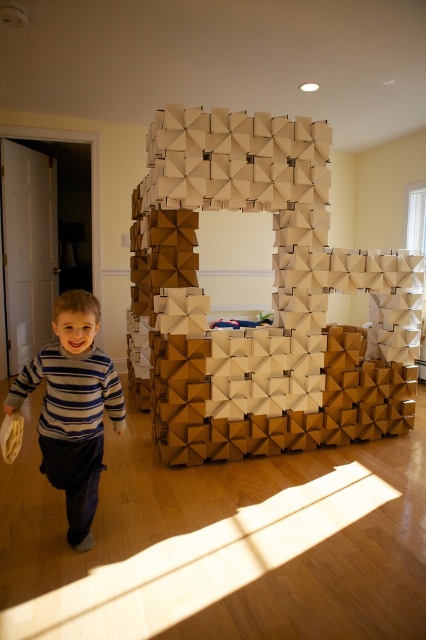
Question: In this image, where is white cardboard structure at center located relative to striped sweater at center?

Choices:
 (A) right
 (B) left

Answer: (A)

Question: Which of the following is the farthest from the observer?

Choices:
 (A) white cardboard structure at center
 (B) striped sweater at center

Answer: (A)

Question: Does white cardboard structure at center have a larger size compared to striped sweater at center?

Choices:
 (A) yes
 (B) no

Answer: (A)

Question: Is white cardboard structure at center positioned before striped sweater at center?

Choices:
 (A) yes
 (B) no

Answer: (B)